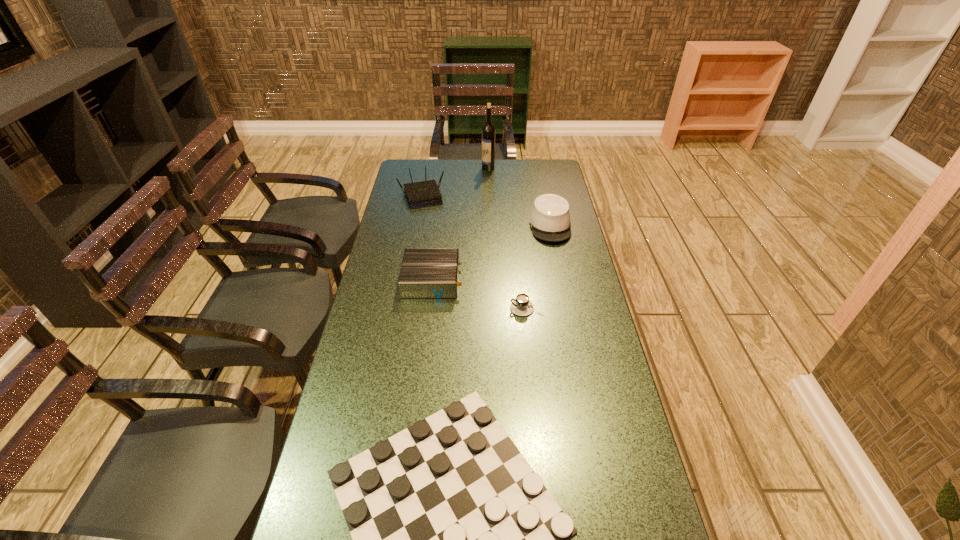
I want to click on object at the far left corner, so click(422, 194).

Where is `vacant space at the far edge`? This screenshot has height=540, width=960. vacant space at the far edge is located at coordinates (505, 178).

The width and height of the screenshot is (960, 540). I want to click on free location at the left edge, so click(366, 288).

Identify the location of free space at the right edge. (556, 185).

The height and width of the screenshot is (540, 960). Identify the location of vacant position at the far left corner of the desktop. (427, 161).

In the image, there is a desktop. Identify the location of vacant space at the far right corner. (552, 166).

I want to click on free space that is in between the farther router and the nearer router, so point(426,238).

At what (x,y) coordinates should I click in order to perform the action: click on free point between the taller router and the fourth farthest object. Please return your answer as a coordinate pair (x, y). This screenshot has height=540, width=960. Looking at the image, I should click on (426, 238).

This screenshot has height=540, width=960. I want to click on vacant space that's between the farthest object and the third nearest object, so [x=460, y=224].

Identify the location of free space between the nearer router and the second nearest object. Image resolution: width=960 pixels, height=540 pixels. pyautogui.click(x=479, y=294).